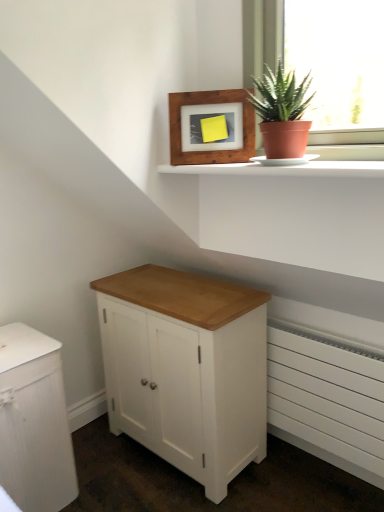
This screenshot has height=512, width=384. Describe the element at coordinates (186, 369) in the screenshot. I see `white wood cabinet at center, which is the 2th chest of drawers from left to right` at that location.

Where is `wooden frame at upper center`? The height and width of the screenshot is (512, 384). wooden frame at upper center is located at coordinates click(210, 103).

What do you see at coordinates (282, 113) in the screenshot? Image resolution: width=384 pixels, height=512 pixels. I see `green matte plant at upper right` at bounding box center [282, 113].

Image resolution: width=384 pixels, height=512 pixels. Describe the element at coordinates (284, 169) in the screenshot. I see `white smooth window sill at upper center` at that location.

The height and width of the screenshot is (512, 384). I want to click on white smooth window sill at upper center, so click(284, 169).

Find the location of a particular element. This screenshot has height=512, width=384. white wood cabinet at center, acting as the first chest of drawers starting from the right is located at coordinates (186, 369).

How much distance is there between white wood cabinet at center, acting as the first chest of drawers starting from the right, and white smooth window sill at upper center?

white wood cabinet at center, acting as the first chest of drawers starting from the right, and white smooth window sill at upper center are 29.66 inches apart from each other.

From the image's perspective, would you say white wood cabinet at center, which is the 2th chest of drawers from left to right, is shown under white smooth window sill at upper center?

Yes.

Considering the positions of objects white wood cabinet at center, acting as the first chest of drawers starting from the right, and white smooth window sill at upper center in the image provided, who is more to the left, white wood cabinet at center, acting as the first chest of drawers starting from the right, or white smooth window sill at upper center?

white wood cabinet at center, acting as the first chest of drawers starting from the right.

Would you say white wood cabinet at center, which is the 2th chest of drawers from left to right, is inside or outside white smooth window sill at upper center?

white wood cabinet at center, which is the 2th chest of drawers from left to right, is not enclosed by white smooth window sill at upper center.

Find the location of a particular element. Image resolution: width=384 pixels, height=512 pixels. radiator below the white wood cabinet at lower left, which is the second chest of drawers from right to left (from a real-world perspective) is located at coordinates (327, 402).

How far apart are white matte radiator at lower right and white wood cabinet at lower left, the 1th chest of drawers from the left?

The distance of white matte radiator at lower right from white wood cabinet at lower left, the 1th chest of drawers from the left, is 36.62 inches.

Considering the sizes of objects white matte radiator at lower right and white wood cabinet at lower left, which is the second chest of drawers from right to left, in the image provided, who is bigger, white matte radiator at lower right or white wood cabinet at lower left, which is the second chest of drawers from right to left,?

Bigger between the two is white wood cabinet at lower left, which is the second chest of drawers from right to left.

How different are the orientations of white matte radiator at lower right and white wood cabinet at lower left, the 1th chest of drawers from the left, in degrees?

They differ by 89.9 degrees in their facing directions.

Identify the location of radiator to the right of white smooth window sill at upper center. This screenshot has height=512, width=384. (327, 402).

From a real-world perspective, which is physically below, white matte radiator at lower right or white smooth window sill at upper center?

In real-world perspective, white matte radiator at lower right is lower.

Does white matte radiator at lower right come in front of white smooth window sill at upper center?

No, white matte radiator at lower right is further to the viewer.

Is white matte radiator at lower right spatially inside white smooth window sill at upper center, or outside of it?

white matte radiator at lower right is not enclosed by white smooth window sill at upper center.

Considering the relative positions of green matte plant at upper right and white smooth window sill at upper center in the image provided, is green matte plant at upper right to the left or to the right of white smooth window sill at upper center?

Clearly, green matte plant at upper right is on the right of white smooth window sill at upper center in the image.

In the scene shown: From a real-world perspective, which is physically below, green matte plant at upper right or white smooth window sill at upper center?

white smooth window sill at upper center is physically lower.

Consider the image. Is green matte plant at upper right bigger or smaller than white smooth window sill at upper center?

Clearly, green matte plant at upper right is larger in size than white smooth window sill at upper center.

Choose the correct answer: Is green matte plant at upper right inside white smooth window sill at upper center or outside it?

green matte plant at upper right exists outside the volume of white smooth window sill at upper center.

Can you tell me how much wooden frame at upper center and green matte plant at upper right differ in facing direction?

36 degrees.

From their relative heights in the image, would you say wooden frame at upper center is taller or shorter than green matte plant at upper right?

Clearly, wooden frame at upper center is taller compared to green matte plant at upper right.

Between wooden frame at upper center and green matte plant at upper right, which one has larger width?

green matte plant at upper right is wider.

Which object is closer to the camera taking this photo, white wood cabinet at center, which is the 2th chest of drawers from left to right, or white wood cabinet at lower left, which is the second chest of drawers from right to left?

white wood cabinet at lower left, which is the second chest of drawers from right to left.

How much distance is there between white wood cabinet at center, which is the 2th chest of drawers from left to right, and white wood cabinet at lower left, which is the second chest of drawers from right to left?

white wood cabinet at center, which is the 2th chest of drawers from left to right, is 18.27 inches from white wood cabinet at lower left, which is the second chest of drawers from right to left.

Is white wood cabinet at center, acting as the first chest of drawers starting from the right, outside of white wood cabinet at lower left, the 1th chest of drawers from the left?

white wood cabinet at center, acting as the first chest of drawers starting from the right, is positioned outside white wood cabinet at lower left, the 1th chest of drawers from the left.

Is white matte radiator at lower right a part of white wood cabinet at lower left, which is the second chest of drawers from right to left?

No, white matte radiator at lower right is not a part of white wood cabinet at lower left, which is the second chest of drawers from right to left.

Looking at this image, can you tell me how much white wood cabinet at lower left, which is the second chest of drawers from right to left, and white matte radiator at lower right differ in facing direction?

89.9 degrees.

From a real-world perspective, relative to white matte radiator at lower right, is white wood cabinet at lower left, the 1th chest of drawers from the left, vertically above or below?

Clearly, from a real-world perspective, white wood cabinet at lower left, the 1th chest of drawers from the left, is above white matte radiator at lower right.

Does white wood cabinet at lower left, the 1th chest of drawers from the left, have a lesser width compared to white matte radiator at lower right?

No.

Where is `the 2nd chest of drawers behind the white smooth window sill at upper center, starting your count from the anchor`? the 2nd chest of drawers behind the white smooth window sill at upper center, starting your count from the anchor is located at coordinates (186, 369).

This screenshot has width=384, height=512. Find the location of `the 2nd chest of drawers to the left of the white matte radiator at lower right, counting from the anchor's position`. the 2nd chest of drawers to the left of the white matte radiator at lower right, counting from the anchor's position is located at coordinates (34, 422).

Considering their positions, is wooden frame at upper center positioned further to white wood cabinet at center, which is the 2th chest of drawers from left to right, than white wood cabinet at lower left, which is the second chest of drawers from right to left?

wooden frame at upper center is positioned further to the anchor white wood cabinet at center, which is the 2th chest of drawers from left to right.

Based on their spatial positions, is white wood cabinet at lower left, which is the second chest of drawers from right to left, or white smooth window sill at upper center further from wooden frame at upper center?

The object further to wooden frame at upper center is white wood cabinet at lower left, which is the second chest of drawers from right to left.

Looking at the image, which one is located closer to white matte radiator at lower right, white wood cabinet at lower left, which is the second chest of drawers from right to left, or green matte plant at upper right?

green matte plant at upper right is closer to white matte radiator at lower right.

When comparing their distances from white matte radiator at lower right, does wooden frame at upper center or white smooth window sill at upper center seem further?

The object further to white matte radiator at lower right is wooden frame at upper center.

Which object lies nearer to the anchor point green matte plant at upper right, white smooth window sill at upper center or wooden frame at upper center?

white smooth window sill at upper center is closer to green matte plant at upper right.

Considering their positions, is white matte radiator at lower right positioned further to wooden frame at upper center than white smooth window sill at upper center?

white matte radiator at lower right.

From the picture: Considering their positions, is green matte plant at upper right positioned further to white matte radiator at lower right than white wood cabinet at lower left, the 1th chest of drawers from the left?

white wood cabinet at lower left, the 1th chest of drawers from the left, lies further to white matte radiator at lower right than the other object.

Based on their spatial positions, is white wood cabinet at lower left, the 1th chest of drawers from the left, or wooden frame at upper center closer to white matte radiator at lower right?

Based on the image, wooden frame at upper center appears to be nearer to white matte radiator at lower right.

Find the location of `the chest of drawers that lies between green matte plant at upper right and white wood cabinet at lower left, which is the second chest of drawers from right to left, from top to bottom`. the chest of drawers that lies between green matte plant at upper right and white wood cabinet at lower left, which is the second chest of drawers from right to left, from top to bottom is located at coordinates (186, 369).

Locate an element on the screen. This screenshot has width=384, height=512. window sill between green matte plant at upper right and white wood cabinet at center, acting as the first chest of drawers starting from the right, in the vertical direction is located at coordinates (284, 169).

Where is `window sill between wooden frame at upper center and white wood cabinet at lower left, the 1th chest of drawers from the left, in the up-down direction`? The width and height of the screenshot is (384, 512). window sill between wooden frame at upper center and white wood cabinet at lower left, the 1th chest of drawers from the left, in the up-down direction is located at coordinates (284, 169).

The height and width of the screenshot is (512, 384). I want to click on radiator between wooden frame at upper center and white wood cabinet at lower left, which is the second chest of drawers from right to left, in the vertical direction, so click(x=327, y=402).